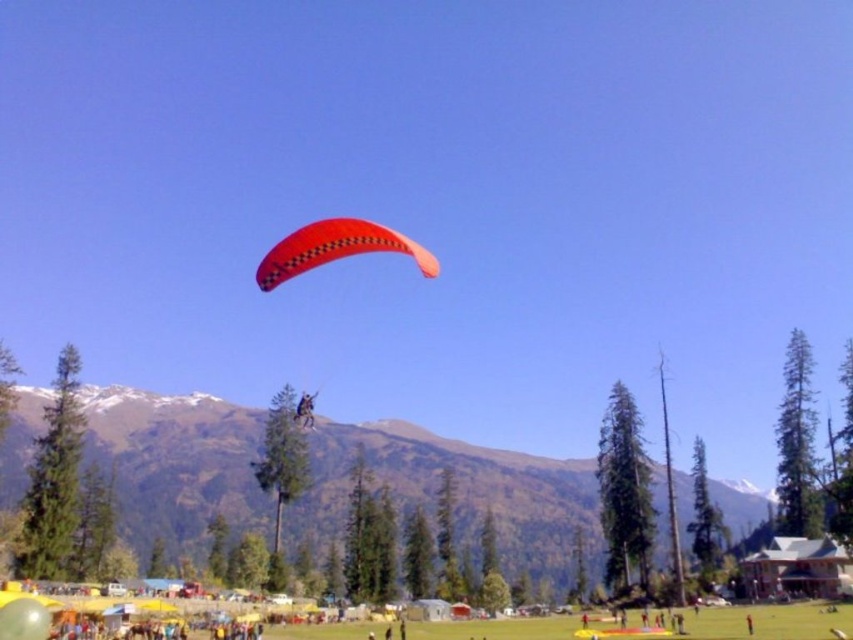
Does matte orange parachute at center appear over leather jacket at center?

Yes.

Between point (320, 221) and point (297, 412), which one is positioned behind?

The point (297, 412) is more distant.

Locate an element on the screen. This screenshot has height=640, width=853. matte orange parachute at center is located at coordinates (335, 248).

Is snowy rock mountain at upper center bigger than matte orange parachute at center?

Yes.

Image resolution: width=853 pixels, height=640 pixels. In order to click on snowy rock mountain at upper center in this screenshot , I will do `click(460, 492)`.

Where is `snowy rock mountain at upper center`? This screenshot has width=853, height=640. snowy rock mountain at upper center is located at coordinates (460, 492).

Is snowy rock mountain at upper center bigger than orange matte parachute at center?

Indeed, snowy rock mountain at upper center has a larger size compared to orange matte parachute at center.

Which is behind, point (16, 468) or point (422, 248)?

Point (422, 248)

Find the location of a particular element. This screenshot has width=853, height=640. snowy rock mountain at upper center is located at coordinates (460, 492).